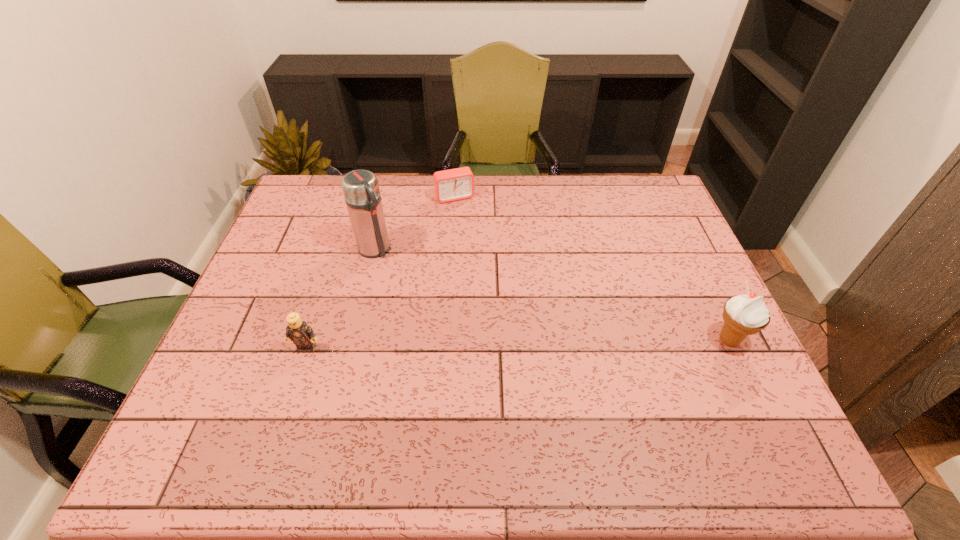
At what (x,y) coordinates should I click in order to perform the action: click on vacant area at the left edge of the desktop. Please return your answer as a coordinate pair (x, y). The height and width of the screenshot is (540, 960). Looking at the image, I should click on (323, 240).

The width and height of the screenshot is (960, 540). In the image, there is a desktop. What are the coordinates of `free space at the right edge` in the screenshot? It's located at (689, 325).

This screenshot has height=540, width=960. I want to click on vacant space at the far left corner, so click(x=310, y=212).

Image resolution: width=960 pixels, height=540 pixels. Identify the location of vacant region at the far right corner of the desktop. (639, 180).

Locate an element on the screen. This screenshot has height=540, width=960. free space between the shortest object and the third tallest object is located at coordinates (381, 273).

Where is `unoccupied position between the third tallest object and the icecream`? The image size is (960, 540). unoccupied position between the third tallest object and the icecream is located at coordinates (518, 344).

The width and height of the screenshot is (960, 540). I want to click on empty space that is in between the icecream and the third object from right to left, so [552, 294].

Find the location of a particular element. vacant region between the alarm clock and the leftmost object is located at coordinates (381, 273).

Identify the location of free area in between the alarm clock and the second shortest object. (381, 273).

Locate an element on the screen. free area in between the second tallest object and the leftmost object is located at coordinates (518, 344).